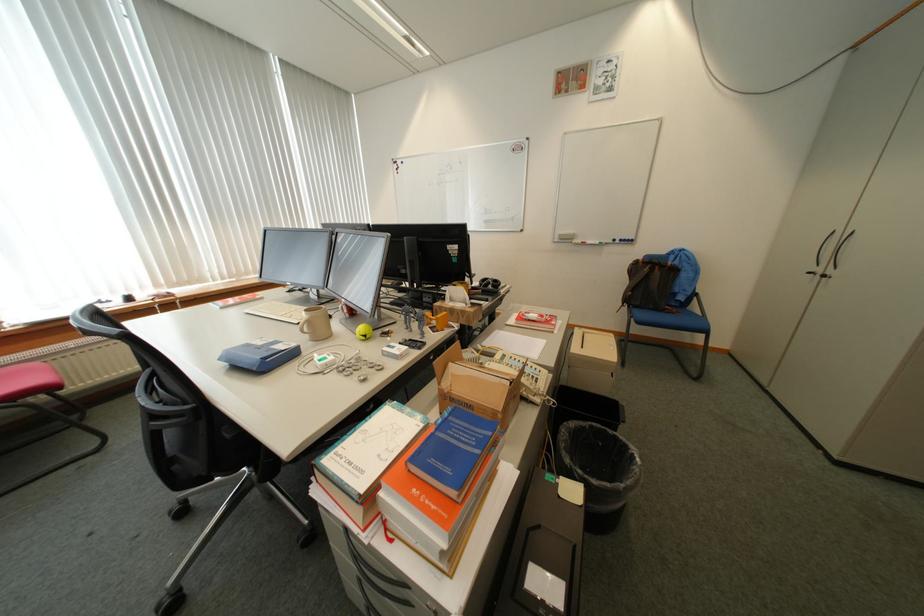
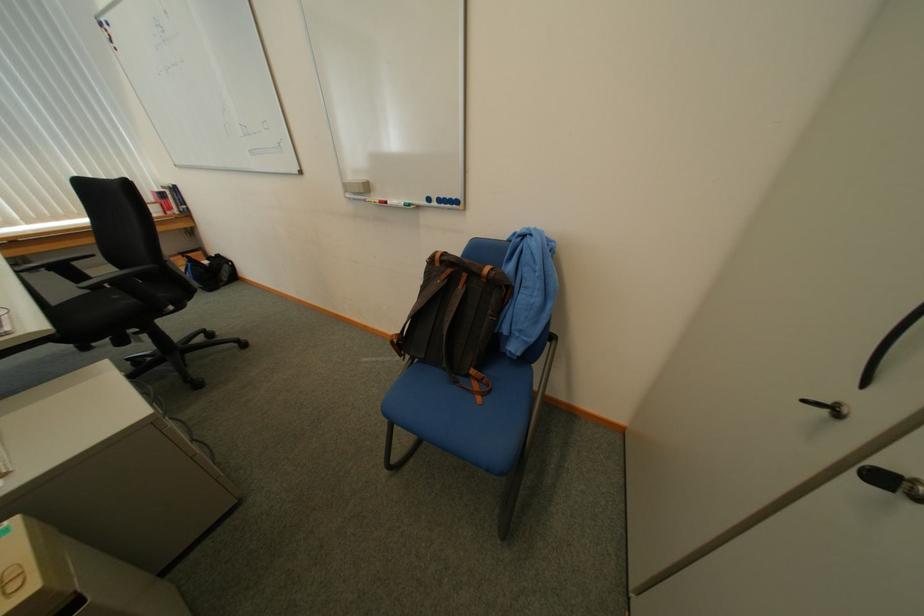
In a continuous first-person perspective shot, in which direction is the camera moving?

The movement direction of the cameraman is right, forward.